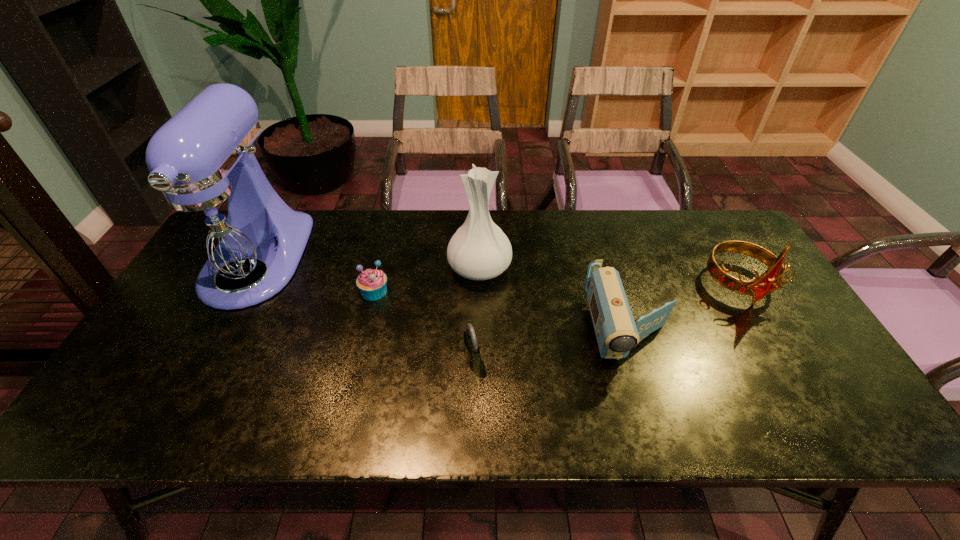
At what (x,y) coordinates should I click in order to perform the action: click on vacant space located at the mixing area of the leftmost object. Please return your answer as a coordinate pair (x, y). Image resolution: width=960 pixels, height=540 pixels. Looking at the image, I should click on (203, 359).

At what (x,y) coordinates should I click in order to perform the action: click on vacant area situated 0.400m on the right of the second tallest object. Please return your answer as a coordinate pair (x, y). Looking at the image, I should click on (645, 268).

Locate an element on the screen. blank area located 0.090m on the front-facing side of the tiara is located at coordinates (771, 338).

The image size is (960, 540). In order to click on free space located 0.090m on the side of the third shortest object with the flip-out screen in this screenshot , I will do click(654, 410).

This screenshot has width=960, height=540. Find the location of `vacant position located on the back of the fifth tallest object`. vacant position located on the back of the fifth tallest object is located at coordinates (473, 259).

This screenshot has height=540, width=960. What are the coordinates of `vacant region located 0.300m on the right of the second object from left to right` in the screenshot? It's located at (495, 291).

Locate an element on the screen. This screenshot has width=960, height=540. mixer present at the far edge is located at coordinates (220, 225).

Find the location of a particular element. Image resolution: width=960 pixels, height=540 pixels. vase situated at the far edge is located at coordinates (479, 250).

Locate an element on the screen. object situated at the left edge is located at coordinates (220, 225).

The height and width of the screenshot is (540, 960). I want to click on object situated at the right edge, so click(x=758, y=287).